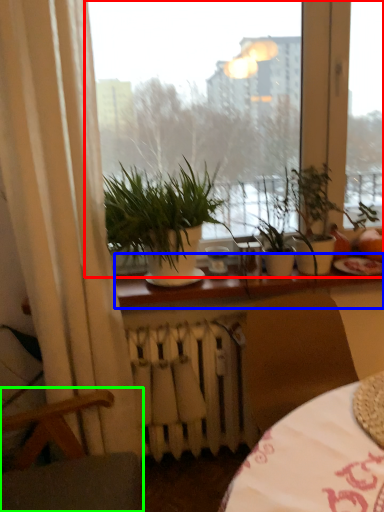
Question: Which object is positioned farthest from window (highlighted by a red box)? Select from window sill (highlighted by a blue box) and armchair (highlighted by a green box).

Choices:
 (A) window sill
 (B) armchair

Answer: (B)